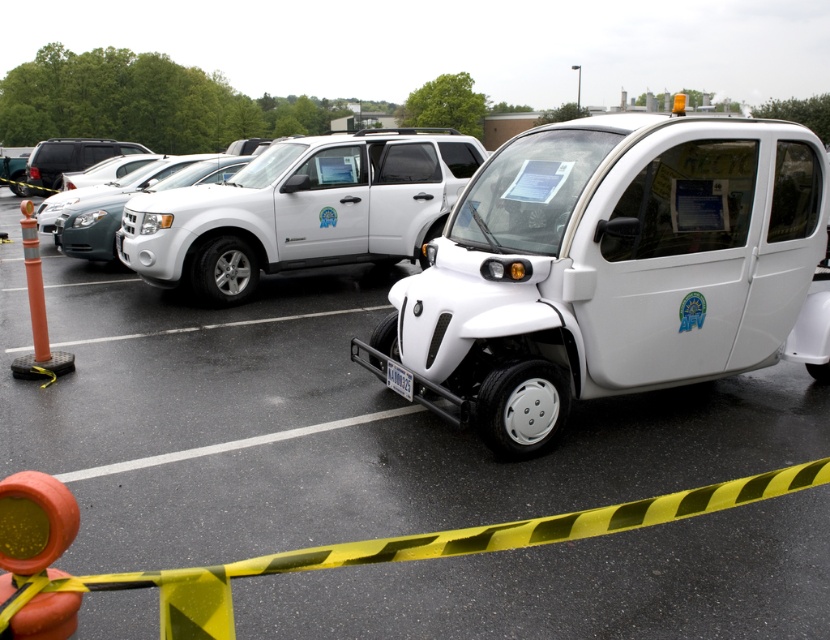
Question: Among these objects, which one is nearest to the camera?

Choices:
 (A) white matte suv at upper center
 (B) white matte electric car at center
 (C) white matte suv at center

Answer: (B)

Question: Is white matte electric car at center thinner than white matte suv at upper center?

Choices:
 (A) yes
 (B) no

Answer: (A)

Question: Among these points, which one is farthest from the camera?

Choices:
 (A) (210, 163)
 (B) (648, 172)
 (C) (301, 230)

Answer: (A)

Question: Does white matte suv at upper center appear on the right side of white matte suv at center?

Choices:
 (A) no
 (B) yes

Answer: (B)

Question: Can you confirm if white matte electric car at center is bigger than white matte suv at center?

Choices:
 (A) no
 (B) yes

Answer: (B)

Question: Among these objects, which one is nearest to the camera?

Choices:
 (A) white matte suv at center
 (B) white matte suv at upper center

Answer: (B)